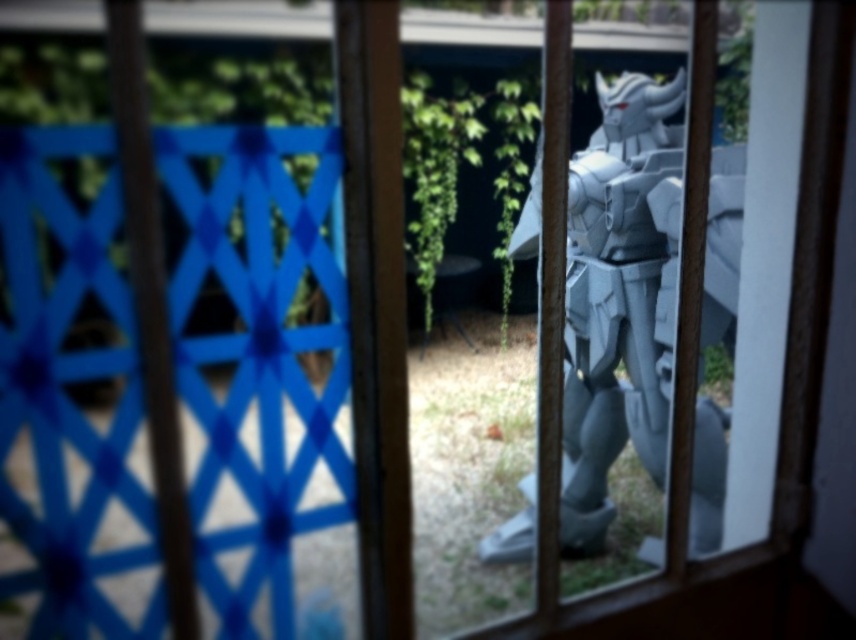
From the picture: You are a delivery drone that needs to fly through the gap between the blue lattice fence at left and the camera. Your drone has a wingspan of 1.2 meters. Can you safely pass through the gap?

The gap between the blue lattice fence at left and the camera is 1.32 meters, which is wider than the drone wingspan of 1.2 meters. Yes, the drone can safely pass through the gap.

You are a painter standing in front of the window with wooden bars. You want to paint the blue lattice fence at left and the gray metallic armor at center. Which object should you focus on first if you want to paint the wider one?

The blue lattice fence at left is wider than the gray metallic armor at center, so you should focus on painting the blue lattice fence at left first.